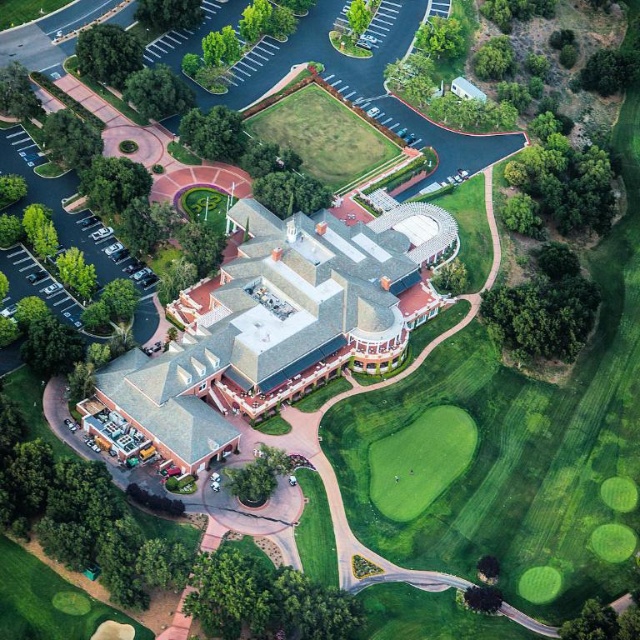
Question: Which object appears closest to the camera in this image?

Choices:
 (A) light brown stone mansion at center
 (B) green smooth turf at center
 (C) white plastic antenna at center

Answer: (A)

Question: Does light brown stone mansion at center appear on the right side of white plastic antenna at center?

Choices:
 (A) yes
 (B) no

Answer: (A)

Question: Can you confirm if light brown stone mansion at center is thinner than green smooth turf at center?

Choices:
 (A) no
 (B) yes

Answer: (A)

Question: Which of the following is the farthest from the observer?

Choices:
 (A) (435, 499)
 (B) (179, 445)

Answer: (A)

Question: Is green smooth turf at center above white plastic antenna at center?

Choices:
 (A) yes
 (B) no

Answer: (B)

Question: Among these objects, which one is nearest to the camera?

Choices:
 (A) white plastic antenna at center
 (B) light brown stone mansion at center
 (C) green smooth turf at center

Answer: (B)